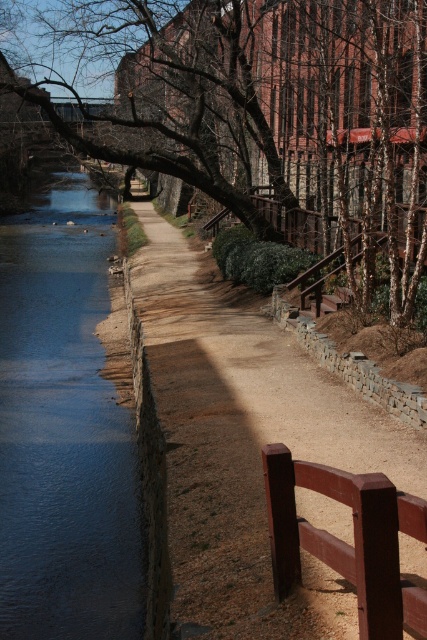
You are standing at the point closer to you between the two points, point (315, 160) and point (5, 394). Which point are you standing at?

You are standing at point (315, 160) because it is further to the viewer than point (5, 394).

You are a hiker who wants to cross from the gravel path to the water. Based on the scene, which direction should you move to reach the blue smooth water at left from the brown gravel path at center?

The brown gravel path at center is to the right of blue smooth water at left, so to reach the blue smooth water at left from the brown gravel path at center, you should move to the left.

You are standing on the brown gravel path at center and want to reach the blue smooth water at left. Which direction should you move to get closer to the water?

To reach the blue smooth water at left from the brown gravel path at center, you should move upward since the path is located below the water.